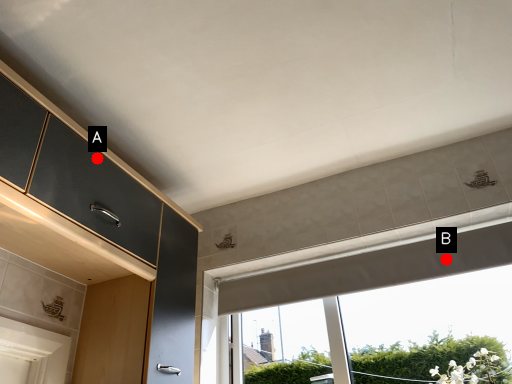
Question: Two points are circled on the image, labeled by A and B beside each circle. Which point is closer to the camera?

Choices:
 (A) A is closer
 (B) B is closer

Answer: (A)